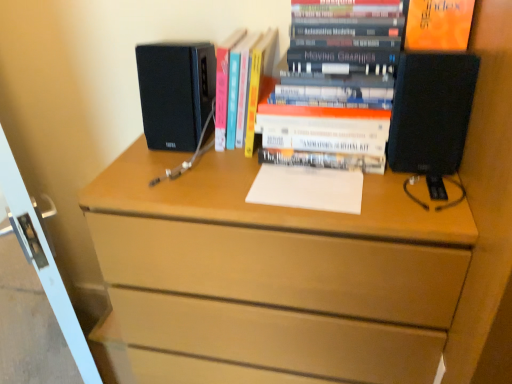
This screenshot has height=384, width=512. I want to click on vacant space situated on the left part of white paper at center, so click(215, 180).